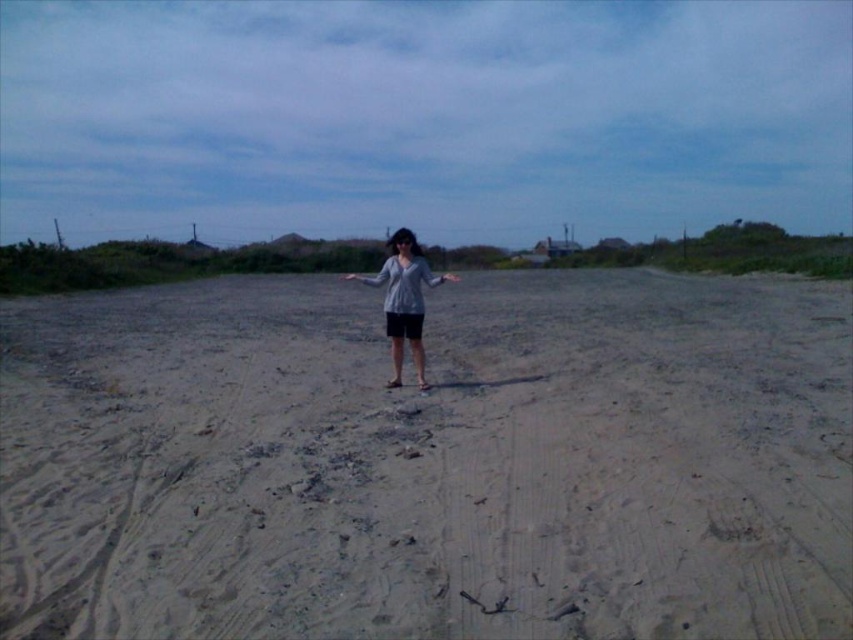
Question: Does light brown sandy ground at center come behind gray matte sweater at center?

Choices:
 (A) yes
 (B) no

Answer: (B)

Question: Which point is farther from the camera taking this photo?

Choices:
 (A) (395, 273)
 (B) (770, 634)

Answer: (A)

Question: Which point is closer to the camera?

Choices:
 (A) gray matte sweater at center
 (B) light brown sandy ground at center

Answer: (B)

Question: Does light brown sandy ground at center have a larger size compared to gray matte sweater at center?

Choices:
 (A) no
 (B) yes

Answer: (A)

Question: Does light brown sandy ground at center appear on the right side of gray matte sweater at center?

Choices:
 (A) yes
 (B) no

Answer: (A)

Question: Which point is farther from the camera taking this photo?

Choices:
 (A) (554, 272)
 (B) (370, 280)

Answer: (A)